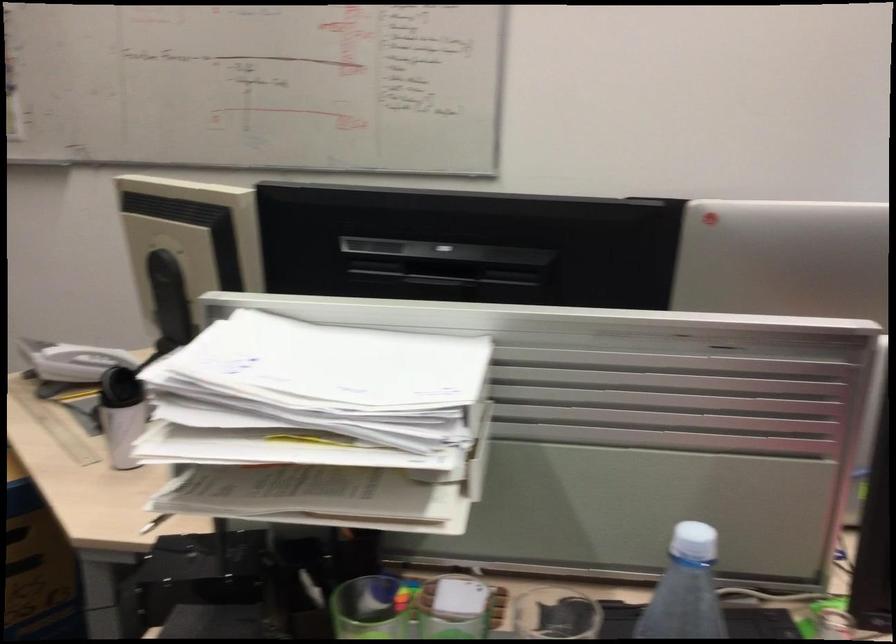
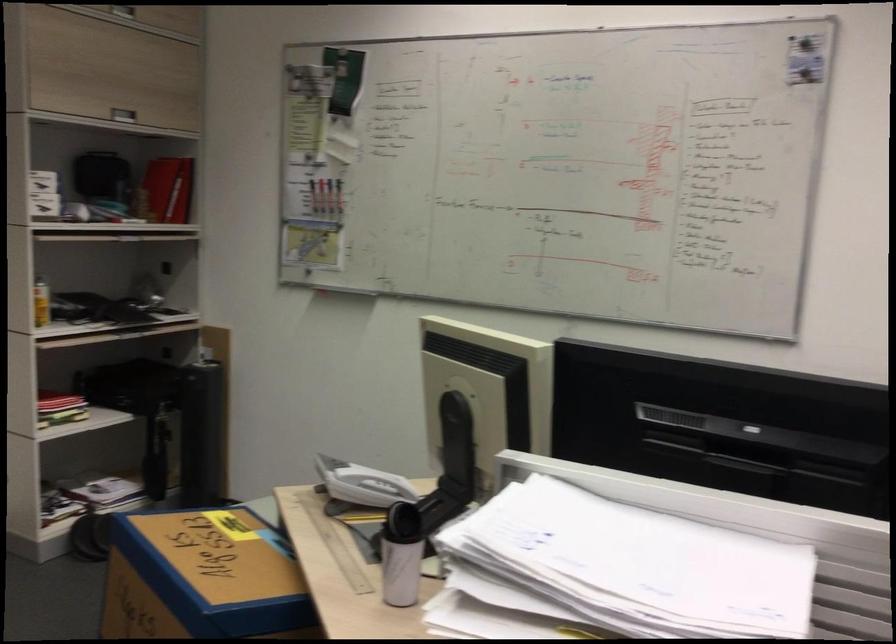
The point at (418, 251) is marked in the first image. Where is the corresponding point in the second image?

(724, 426)